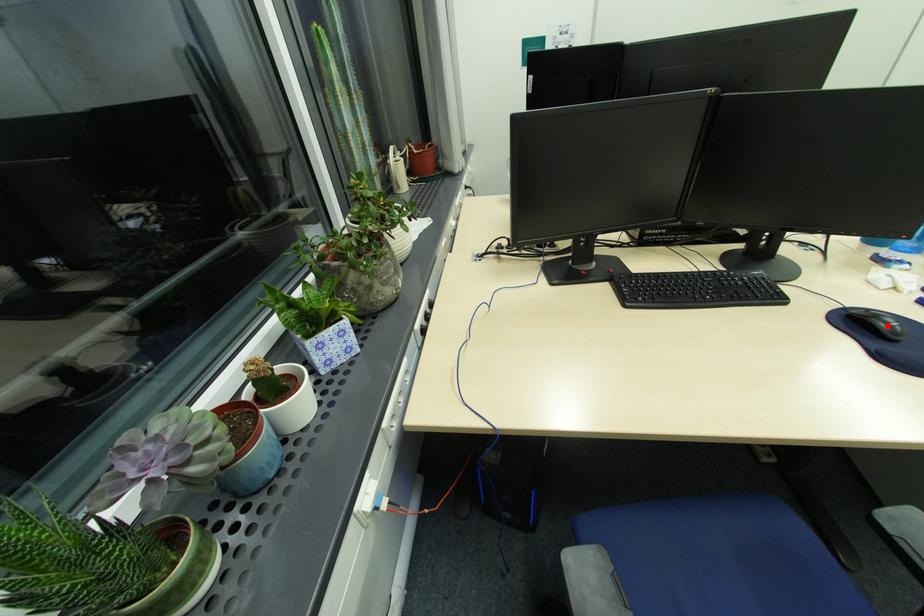
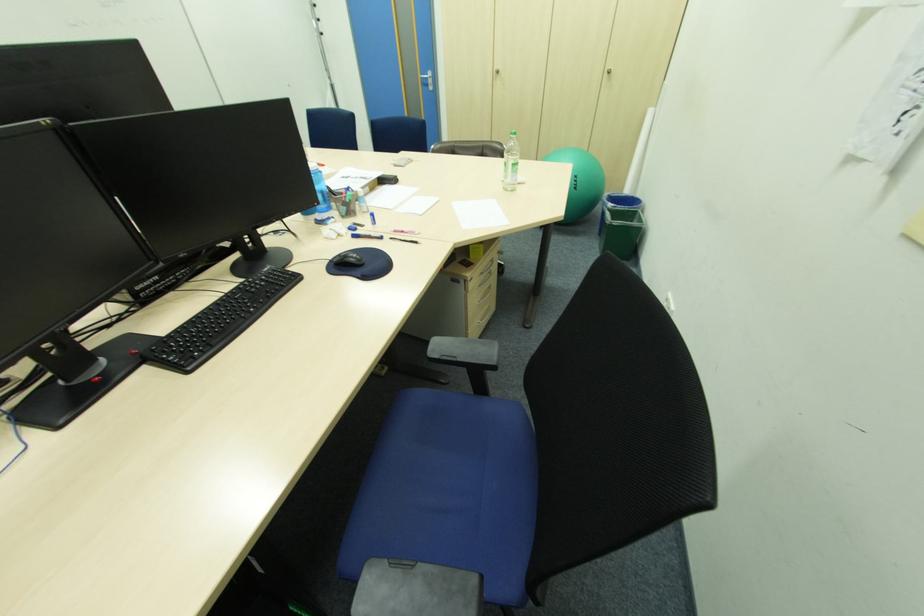
In the second image, find the point that corresponds to the highlighted location in the first image.

(357, 260)